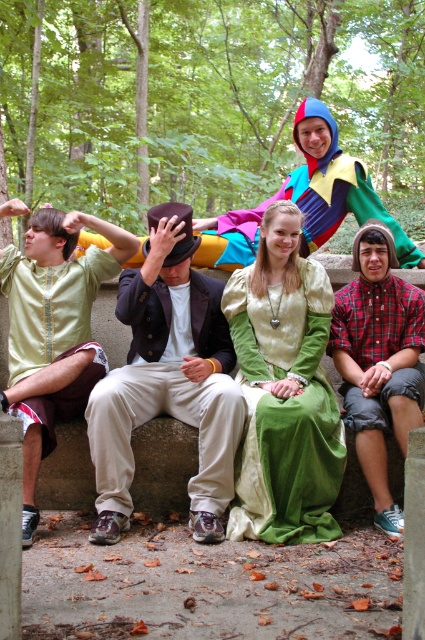
In the scene shown: Between green velvet dress at center and multicolored fabric costume at upper center, which one is positioned higher?

multicolored fabric costume at upper center is above.

Who is lower down, green velvet dress at center or multicolored fabric costume at upper center?

Positioned lower is green velvet dress at center.

Where is `green velvet dress at center`? green velvet dress at center is located at coordinates (285, 410).

Is point (382, 524) in front of point (248, 234)?

Yes, point (382, 524) is closer to viewer.

Does point (339, 310) lie behind point (405, 237)?

No, (339, 310) is in front of (405, 237).

Image resolution: width=425 pixels, height=640 pixels. I want to click on plaid shirt at center, so click(x=379, y=360).

Can you confirm if matte brown hat at center is positioned below multicolored fabric costume at upper center?

Indeed, matte brown hat at center is positioned under multicolored fabric costume at upper center.

Where is `matte brown hat at center`? matte brown hat at center is located at coordinates (x=167, y=380).